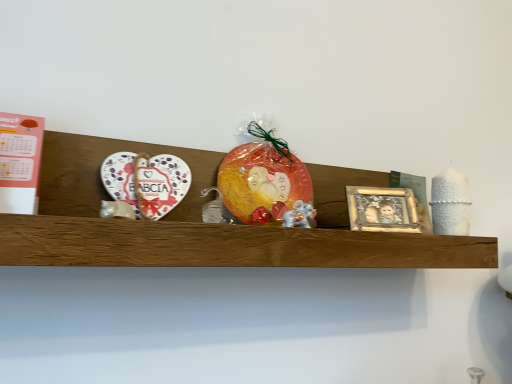
Question: Considering the relative sizes of gold metallic picture frame at center-right and white ceramic heart at left in the image provided, is gold metallic picture frame at center-right taller than white ceramic heart at left?

Choices:
 (A) yes
 (B) no

Answer: (A)

Question: Can you confirm if gold metallic picture frame at center-right is positioned to the left of white ceramic heart at left?

Choices:
 (A) yes
 (B) no

Answer: (B)

Question: From a real-world perspective, is gold metallic picture frame at center-right on top of white ceramic heart at left?

Choices:
 (A) yes
 (B) no

Answer: (B)

Question: Is gold metallic picture frame at center-right smaller than white ceramic heart at left?

Choices:
 (A) no
 (B) yes

Answer: (A)

Question: From the image's perspective, is gold metallic picture frame at center-right below white ceramic heart at left?

Choices:
 (A) yes
 (B) no

Answer: (A)

Question: Can you confirm if gold metallic picture frame at center-right is shorter than white ceramic heart at left?

Choices:
 (A) no
 (B) yes

Answer: (A)

Question: From the image's perspective, is white ceramic heart at left on top of white glossy mouse at center?

Choices:
 (A) no
 (B) yes

Answer: (B)

Question: Could you tell me if white ceramic heart at left is turned towards white glossy mouse at center?

Choices:
 (A) yes
 (B) no

Answer: (B)

Question: Considering the relative positions of white ceramic heart at left and white glossy mouse at center in the image provided, is white ceramic heart at left to the left of white glossy mouse at center from the viewer's perspective?

Choices:
 (A) no
 (B) yes

Answer: (B)

Question: Does white ceramic heart at left come behind white glossy mouse at center?

Choices:
 (A) no
 (B) yes

Answer: (A)

Question: Does white ceramic heart at left have a greater height compared to white glossy mouse at center?

Choices:
 (A) no
 (B) yes

Answer: (B)

Question: From a real-world perspective, does white ceramic heart at left sit lower than white glossy mouse at center?

Choices:
 (A) no
 (B) yes

Answer: (A)

Question: Does white ceramic heart at left appear on the left side of wooden shelf at center?

Choices:
 (A) no
 (B) yes

Answer: (B)